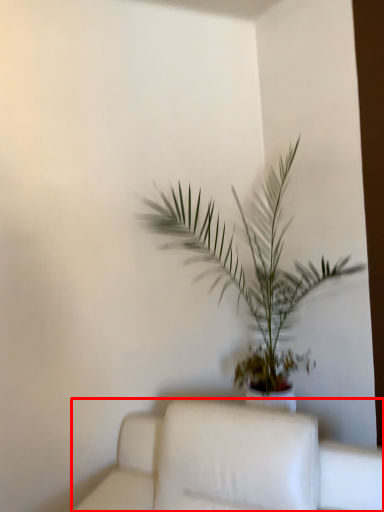
Question: From the image's perspective, where is furniture (annotated by the red box) located in relation to houseplant in the image?

Choices:
 (A) below
 (B) above

Answer: (A)